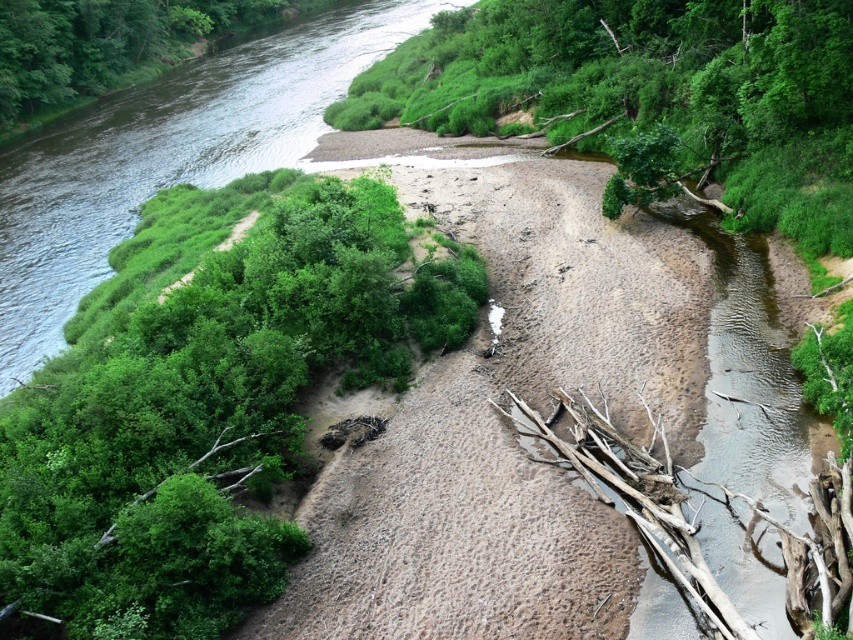
You are standing at the point labeled point (204, 403) and want to walk to the point labeled point (212, 120). Given that both points are on the same path, which direction should you face to move towards your destination?

You should face away from the camera because point (212, 120) is farther from the camera than point (204, 403), so moving in that direction would require facing away from the camera.

You are an environmental scientist assessing the riverbank stability. You observe the green leafy vegetation at upper left and the green leafy tree at upper left. Which of these two has a taller structure?

The green leafy vegetation at upper left is taller than the green leafy tree at upper left according to the description.

You are standing on a bridge overlooking the river and want to determine which object is larger between the green leafy vegetation at upper left and the green leafy tree at upper left. Based on the scene, which one appears larger?

The green leafy vegetation at upper left is bigger than the green leafy tree at upper left, so the vegetation appears larger.